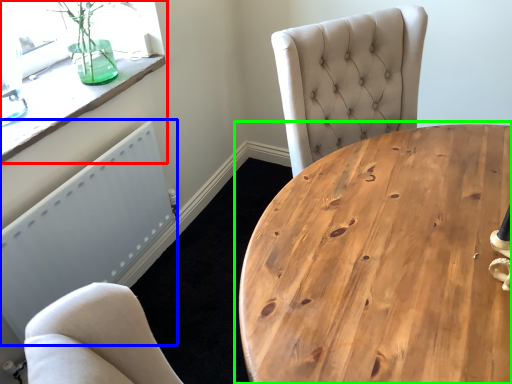
Question: Which is farther away from window (highlighted by a red box)? radiator (highlighted by a blue box) or coffee table (highlighted by a green box)?

Choices:
 (A) radiator
 (B) coffee table

Answer: (B)